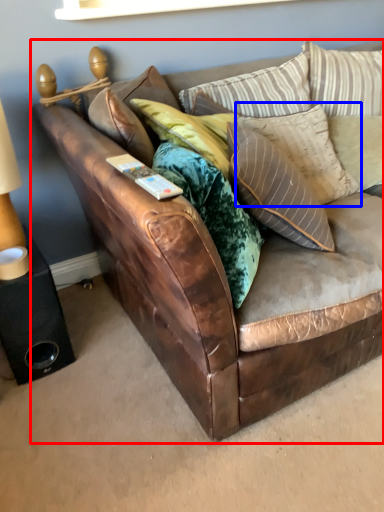
Question: Which object appears farthest to the camera in this image, studio couch (highlighted by a red box) or pillow (highlighted by a blue box)?

Choices:
 (A) studio couch
 (B) pillow

Answer: (B)